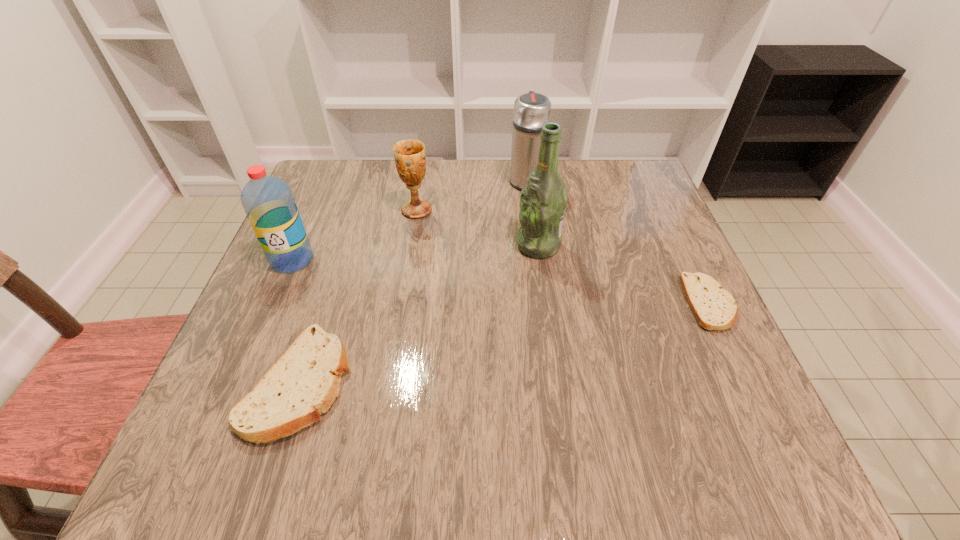
I want to click on water bottle present at the left edge, so click(268, 202).

You are a GUI agent. You are given a task and a screenshot of the screen. Output one action in this format:
    pyautogui.click(x=<x>, y=<y>)
    Task: Click on the object that is at the right edge
    This screenshot has height=540, width=960.
    Given the screenshot: What is the action you would take?
    pyautogui.click(x=714, y=308)

You are a GUI agent. You are given a task and a screenshot of the screen. Output one action in this format:
    pyautogui.click(x=<x>, y=<y>)
    Task: Click on the object located at the near left corner
    The height and width of the screenshot is (540, 960).
    Given the screenshot: What is the action you would take?
    pyautogui.click(x=304, y=382)

In order to click on vacant space at the far edge in this screenshot , I will do `click(485, 165)`.

This screenshot has width=960, height=540. Find the location of `vacant area at the near edge of the desktop`. vacant area at the near edge of the desktop is located at coordinates (646, 387).

Where is `free region at the right edge of the desktop`? The height and width of the screenshot is (540, 960). free region at the right edge of the desktop is located at coordinates (657, 228).

Locate an element on the screen. vacant point at the far left corner is located at coordinates (327, 195).

The width and height of the screenshot is (960, 540). Identify the location of vacant space at the far right corner of the desktop. (602, 204).

This screenshot has height=540, width=960. I want to click on vacant space that is in between the third shortest object and the shortest object, so click(x=564, y=256).

I want to click on vacant area that lies between the taller pita bread and the thermos bottle, so click(x=413, y=281).